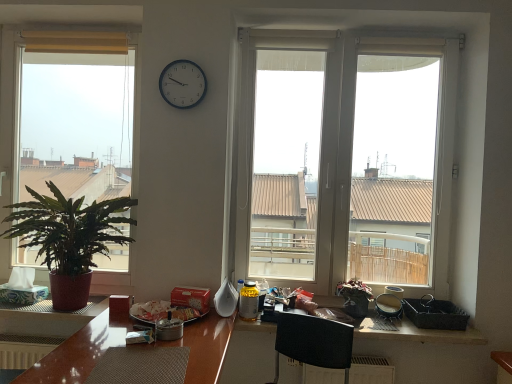
This screenshot has width=512, height=384. Find the location of `free location above green matte plant at left, which appears as the 1th window when viewed from the left (from a real-world perspective)`. free location above green matte plant at left, which appears as the 1th window when viewed from the left (from a real-world perspective) is located at coordinates point(69,25).